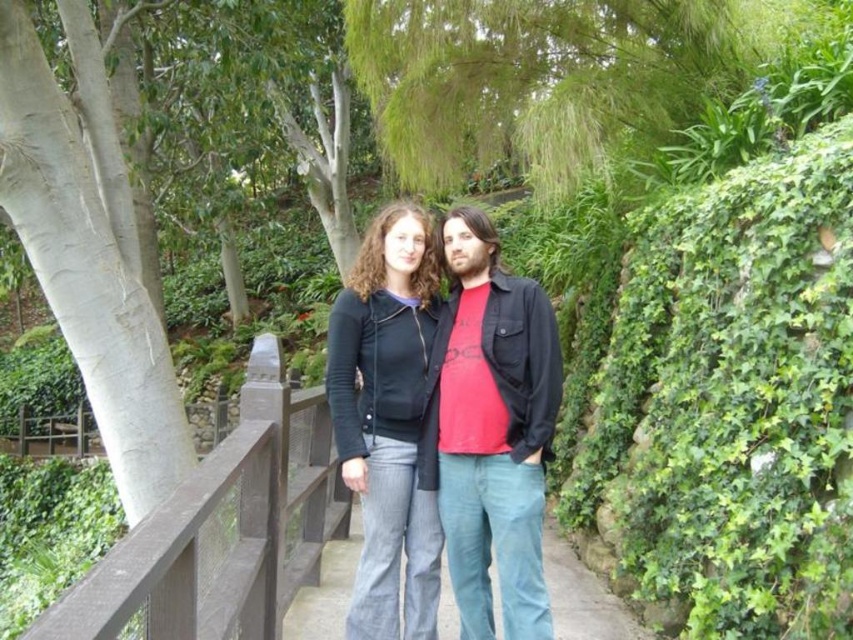
Can you confirm if matte black jacket at center is wider than blue jeans at center?

Correct, the width of matte black jacket at center exceeds that of blue jeans at center.

Describe the element at coordinates (485, 433) in the screenshot. This screenshot has width=853, height=640. I see `matte black jacket at center` at that location.

Identify the location of matte black jacket at center. Image resolution: width=853 pixels, height=640 pixels. 485,433.

Who is lower down, matte black jacket at center or brown wooden rail at center?

brown wooden rail at center is lower down.

Which is in front, point (515, 608) or point (225, 461)?

Point (225, 461)

Between point (415, 268) and point (206, 499), which one is positioned behind?

The point (415, 268) is more distant.

Identify the location of matte black jacket at center. (485, 433).

Is brown wooden rail at center above blue jeans at center?

Indeed, brown wooden rail at center is positioned over blue jeans at center.

Is point (262, 413) farther from camera compared to point (316, 627)?

No, (262, 413) is in front of (316, 627).

Is point (94, 566) farther from camera compared to point (326, 627)?

No, it is not.

Locate an element on the screen. The image size is (853, 640). brown wooden rail at center is located at coordinates (218, 531).